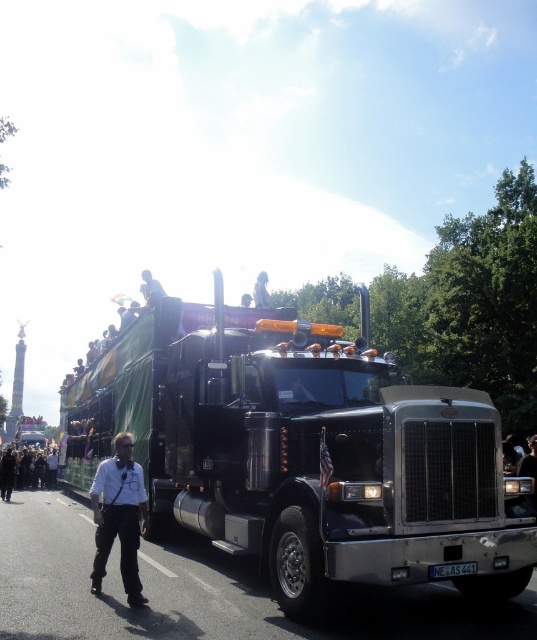
Which is in front, point (10, 451) or point (253, 289)?

Positioned in front is point (253, 289).

Does dark gray pants at lower left have a larger size compared to white fabric at upper center?

No.

Is point (43, 465) positioned in front of point (256, 289)?

No, (43, 465) is further to viewer.

I want to click on dark gray pants at lower left, so click(x=19, y=472).

Which is below, shiny black truck at center or dark gray pants at lower left?

dark gray pants at lower left is lower down.

Does shiny black truck at center have a lesser width compared to dark gray pants at lower left?

In fact, shiny black truck at center might be wider than dark gray pants at lower left.

Is point (466, 461) farther from viewer compared to point (4, 480)?

No.

Identify the location of shiny black truck at center. The width and height of the screenshot is (537, 640). (303, 452).

Can you confirm if shiny black truck at center is bigger than white fabric at upper center?

Correct, shiny black truck at center is larger in size than white fabric at upper center.

Consider the image. Can you confirm if shiny black truck at center is positioned above white fabric at upper center?

Incorrect, shiny black truck at center is not positioned above white fabric at upper center.

What do you see at coordinates (303, 452) in the screenshot? Image resolution: width=537 pixels, height=640 pixels. I see `shiny black truck at center` at bounding box center [303, 452].

Where is `shiny black truck at center`? This screenshot has width=537, height=640. shiny black truck at center is located at coordinates (303, 452).